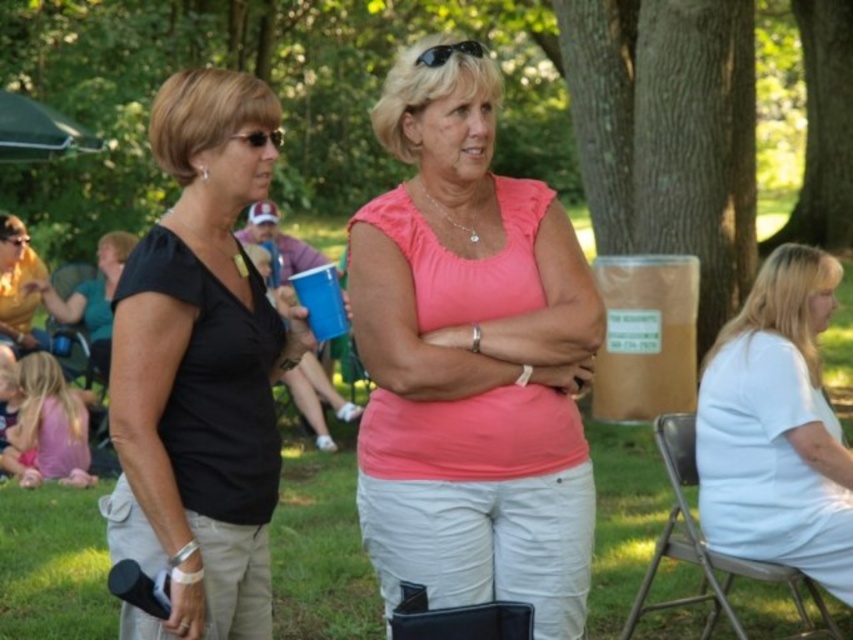
Who is lower down, black matte shirt at left or white cotton shirt at right?

Positioned lower is white cotton shirt at right.

Does point (221, 140) come closer to viewer compared to point (744, 378)?

Yes, point (221, 140) is in front of point (744, 378).

What are the coordinates of `black matte shirt at left` in the screenshot? It's located at (200, 369).

Between point (796, 340) and point (828, 166), which one is positioned behind?

The point (828, 166) is more distant.

Does white cotton shirt at right lie in front of green leafy tree at upper center?

Yes, it is.

Which is behind, point (850, 516) or point (805, 186)?

Positioned behind is point (805, 186).

Identify the location of white cotton shirt at right. This screenshot has height=640, width=853. (776, 428).

Does point (502, 397) lie behind point (712, 148)?

No.

Who is more distant from viewer, (369, 529) or (671, 45)?

Point (671, 45)

The image size is (853, 640). I want to click on pink matte shirt at center, so click(471, 360).

I want to click on pink matte shirt at center, so click(x=471, y=360).